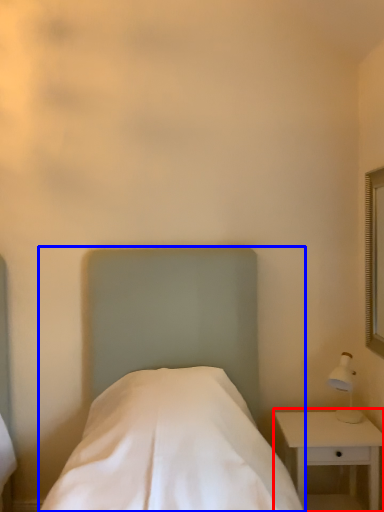
Question: Which point is further to the camera, nightstand (highlighted by a red box) or bed (highlighted by a blue box)?

Choices:
 (A) nightstand
 (B) bed

Answer: (A)